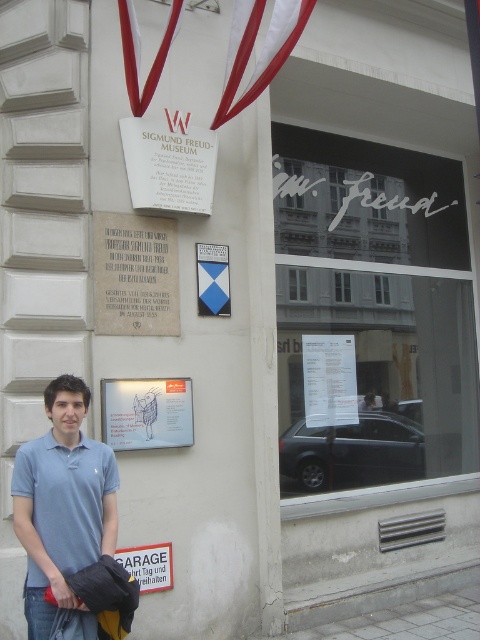
Question: Which is farther from the light blue polo shirt at lower left?

Choices:
 (A) white paper at center
 (B) blue fabric flag at center
 (C) white paper plaque at upper center
 (D) matte white sign at lower center

Answer: (A)

Question: Among these objects, which one is farthest from the camera?

Choices:
 (A) white paper plaque at upper center
 (B) white stone plaque at upper center
 (C) matte white sign at lower center

Answer: (A)

Question: Which of the following is the farthest from the observer?

Choices:
 (A) white paper at center
 (B) matte white sign at lower center
 (C) white paper plaque at upper center

Answer: (A)

Question: Is light blue polo shirt at lower left above white paper at center?

Choices:
 (A) yes
 (B) no

Answer: (B)

Question: Does light blue polo shirt at lower left come in front of white paper at center?

Choices:
 (A) no
 (B) yes

Answer: (B)

Question: Does light blue polo shirt at lower left have a lesser width compared to matte white sign at lower center?

Choices:
 (A) no
 (B) yes

Answer: (B)